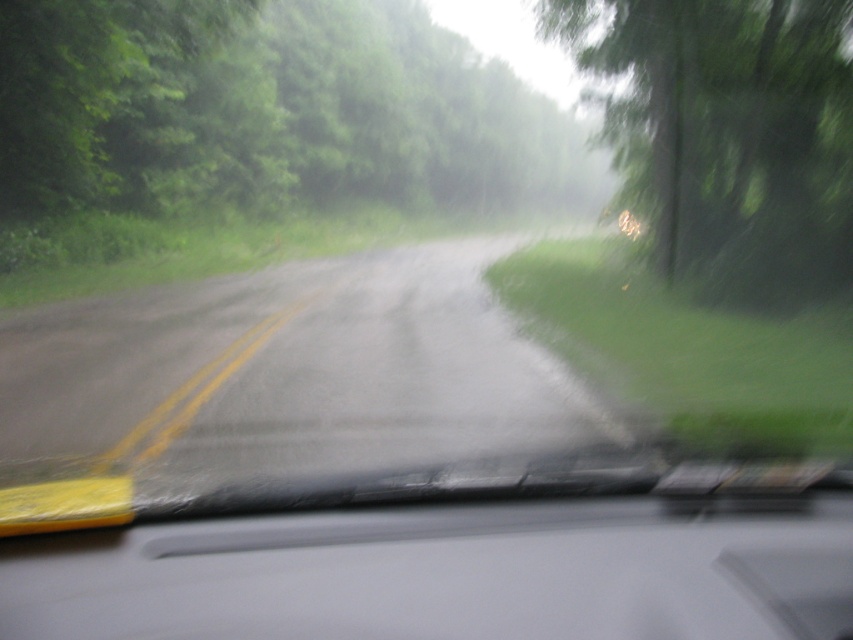
Does green leafy tree at upper left have a smaller size compared to green matte tree at right?

No, green leafy tree at upper left is not smaller than green matte tree at right.

Where is `green leafy tree at upper left`? green leafy tree at upper left is located at coordinates (268, 109).